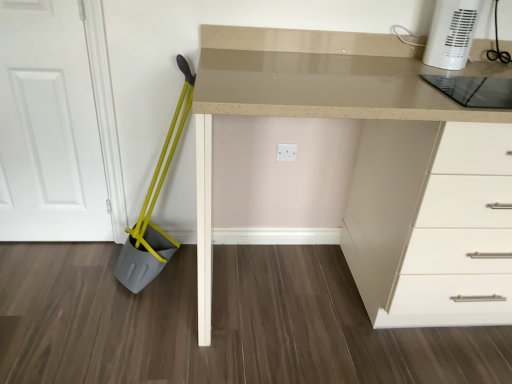
Find the location of a particular element. This screenshot has height=384, width=512. vacant space in front of yellow plastic shovel at left is located at coordinates (138, 324).